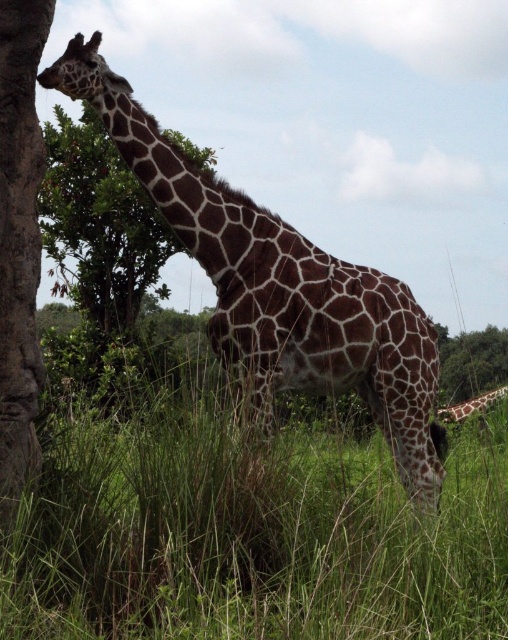
Which is behind, point (116, 332) or point (9, 186)?

The point (116, 332) is behind.

Is green leafy tree at upper left taller than brown rough tree trunk at left?

Indeed, green leafy tree at upper left has a greater height compared to brown rough tree trunk at left.

Is point (67, 259) positioned behind point (29, 346)?

Yes.

Identify the location of green leafy tree at upper left. The width and height of the screenshot is (508, 640). (102, 262).

Is brown spotted giraffe at center taller than green leafy tree at upper left?

Incorrect, brown spotted giraffe at center's height is not larger of green leafy tree at upper left's.

Between brown spotted giraffe at center and green leafy tree at upper left, which one appears on the left side from the viewer's perspective?

green leafy tree at upper left

Locate an element on the screen. The height and width of the screenshot is (640, 508). brown spotted giraffe at center is located at coordinates (279, 288).

Who is more forward, (30, 257) or (505, 392)?

Point (30, 257) is more forward.

Between point (31, 305) and point (451, 416), which one is positioned in front?

Point (31, 305)

Where is `brown rough tree trunk at left`? This screenshot has width=508, height=640. brown rough tree trunk at left is located at coordinates (19, 244).